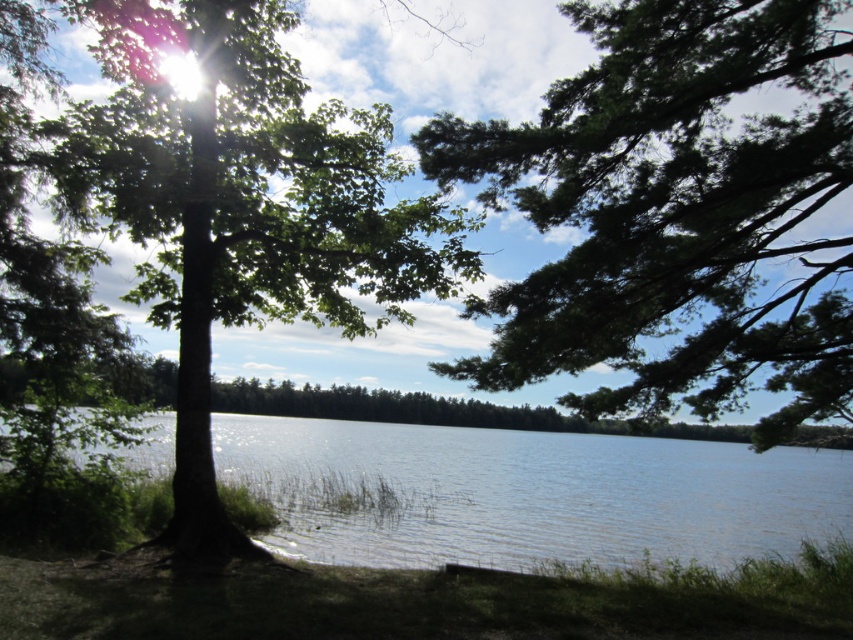
Question: Which object appears closest to the camera in this image?

Choices:
 (A) green grass at lower center
 (B) green needle-like branches at upper right

Answer: (A)

Question: Does green needle-like branches at upper right appear on the right side of green grass at lower center?

Choices:
 (A) no
 (B) yes

Answer: (B)

Question: Is green leafy tree at left below clear water at center?

Choices:
 (A) yes
 (B) no

Answer: (B)

Question: Which of the following is the closest to the observer?

Choices:
 (A) (350, 589)
 (B) (724, 301)

Answer: (A)

Question: Does green leafy tree at left appear under green grass at lower center?

Choices:
 (A) no
 (B) yes

Answer: (A)

Question: Which of the following is the closest to the observer?

Choices:
 (A) (722, 346)
 (B) (184, 138)

Answer: (A)